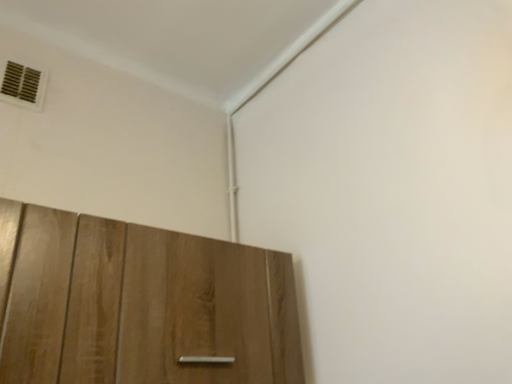
Question: Is wooden cabinet at lower left completely or partially inside metallic vent at upper left?

Choices:
 (A) no
 (B) yes

Answer: (A)

Question: Does metallic vent at upper left have a lesser width compared to wooden cabinet at lower left?

Choices:
 (A) yes
 (B) no

Answer: (A)

Question: Can we say metallic vent at upper left lies outside wooden cabinet at lower left?

Choices:
 (A) yes
 (B) no

Answer: (A)

Question: Considering the relative sizes of metallic vent at upper left and wooden cabinet at lower left in the image provided, is metallic vent at upper left bigger than wooden cabinet at lower left?

Choices:
 (A) yes
 (B) no

Answer: (B)

Question: Is metallic vent at upper left positioned with its back to wooden cabinet at lower left?

Choices:
 (A) yes
 (B) no

Answer: (B)

Question: Is metallic vent at upper left placed right next to wooden cabinet at lower left?

Choices:
 (A) yes
 (B) no

Answer: (B)

Question: From a real-world perspective, is wooden cabinet at lower left located beneath metallic vent at upper left?

Choices:
 (A) no
 (B) yes

Answer: (B)

Question: Is wooden cabinet at lower left at the right side of metallic vent at upper left?

Choices:
 (A) no
 (B) yes

Answer: (B)

Question: Considering the relative positions of wooden cabinet at lower left and metallic vent at upper left in the image provided, is wooden cabinet at lower left to the left of metallic vent at upper left from the viewer's perspective?

Choices:
 (A) yes
 (B) no

Answer: (B)

Question: Is wooden cabinet at lower left wider than metallic vent at upper left?

Choices:
 (A) no
 (B) yes

Answer: (B)

Question: Does wooden cabinet at lower left contain metallic vent at upper left?

Choices:
 (A) yes
 (B) no

Answer: (B)

Question: From the image's perspective, does wooden cabinet at lower left appear higher than metallic vent at upper left?

Choices:
 (A) yes
 (B) no

Answer: (B)

Question: From a real-world perspective, is wooden cabinet at lower left above or below metallic vent at upper left?

Choices:
 (A) above
 (B) below

Answer: (B)